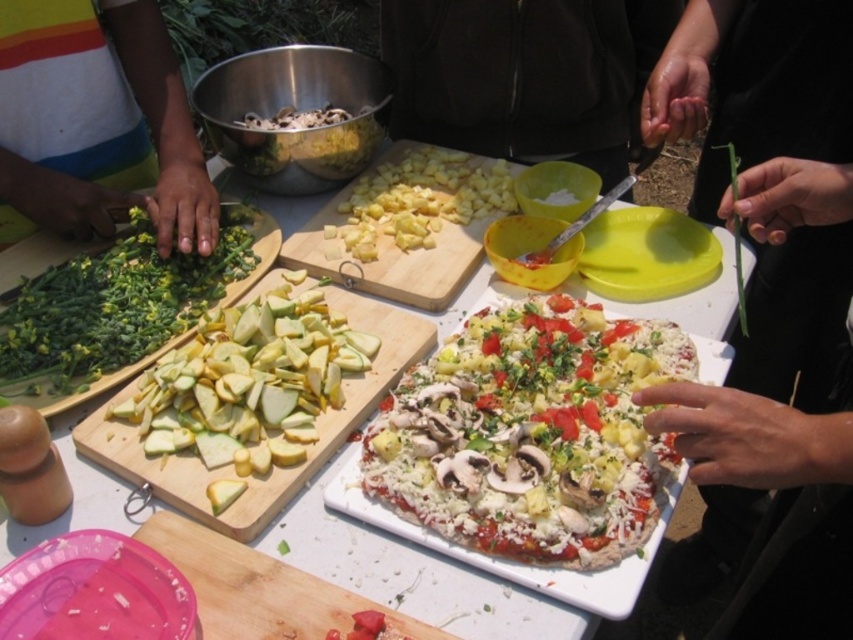
Is green leafy vegetable at upper right smaller than green leafy vegetables at left?

Incorrect, green leafy vegetable at upper right is not smaller in size than green leafy vegetables at left.

Between point (816, 170) and point (138, 19), which one is positioned in front?

Point (816, 170)

Which is in front, point (733, 464) or point (144, 93)?

Point (733, 464) is in front.

You are a GUI agent. You are given a task and a screenshot of the screen. Output one action in this format:
    pyautogui.click(x=<x>, y=<y>)
    Task: Click on the green leafy vegetable at upper right
    
    Given the screenshot: What is the action you would take?
    pyautogui.click(x=763, y=253)

Which is behind, point (187, 624) or point (387, 189)?

The point (387, 189) is behind.

Who is higher up, pink plastic plate at lower left or yellow diced pineapple at center?

Result: Positioned higher is yellow diced pineapple at center.

Describe the element at coordinates (94, 592) in the screenshot. The height and width of the screenshot is (640, 853). I see `pink plastic plate at lower left` at that location.

Image resolution: width=853 pixels, height=640 pixels. Identify the location of pink plastic plate at lower left. (94, 592).

Who is lower down, white rectangular board at center or yellow plastic plate at center?

white rectangular board at center is lower down.

Between white rectangular board at center and yellow plastic plate at center, which one has less height?

yellow plastic plate at center

Who is more distant from viewer, (x=730, y=305) or (x=672, y=216)?

Positioned behind is point (x=672, y=216).

The width and height of the screenshot is (853, 640). I want to click on white rectangular board at center, so click(x=412, y=573).